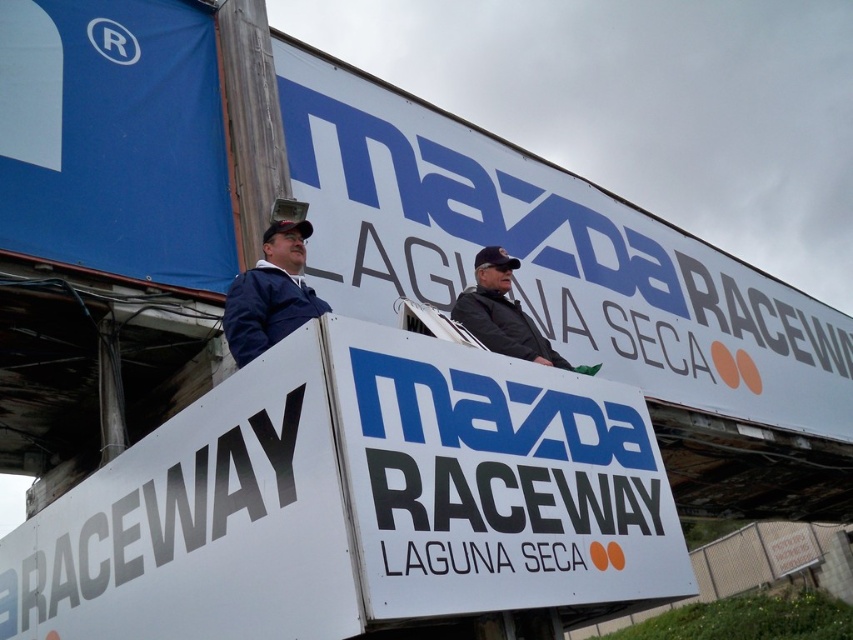
The image size is (853, 640). What do you see at coordinates (547, 253) in the screenshot? I see `white plastic billboard at center` at bounding box center [547, 253].

Does point (425, 104) lie in front of point (459, 316)?

No.

Locate an element on the screen. white plastic billboard at center is located at coordinates (547, 253).

Does white matte signboard at upper center have a lesser height compared to blue fabric jacket at upper left?

No.

Is white matte signboard at upper center wider than blue fabric jacket at upper left?

Indeed, white matte signboard at upper center has a greater width compared to blue fabric jacket at upper left.

This screenshot has width=853, height=640. I want to click on white matte signboard at upper center, so click(x=200, y=524).

Which is more to the left, white plastic billboard at center or white matte signboard at upper center?

white matte signboard at upper center

Is white plastic billboard at center above white matte signboard at upper center?

Indeed, white plastic billboard at center is positioned over white matte signboard at upper center.

At what (x,y) coordinates should I click in order to perform the action: click on white plastic billboard at center. Please return your answer as a coordinate pair (x, y). Looking at the image, I should click on (547, 253).